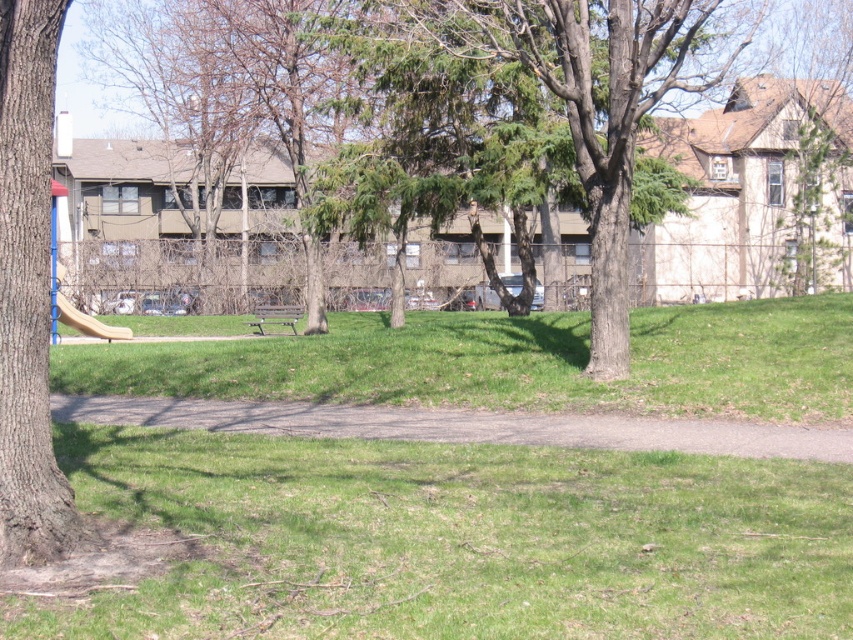
You are a parent trying to locate your child who is playing near the light brown plastic slide at lower left. From your position near the brown rough bark tree at left, which direction should you walk to reach the slide?

You should walk to the left because the light brown plastic slide at lower left is to the left of the brown rough bark tree at left.

You are a parent trying to decide where to place a new small garden ornament. The ornament is 1 foot wide. You have two options near the brown rough bark tree at left and the light brown plastic slide at lower left. Which location has enough space for the ornament?

The light brown plastic slide at lower left has a greater width than the brown rough bark tree at left, so placing the ornament near the light brown plastic slide at lower left would provide sufficient space since it is wider.

In the scene shown: You are a park visitor trying to decide whether to sit under the brown rough bark tree at left or the light brown plastic slide at left. Which one has a wider base to provide more shade?

The light brown plastic slide at left has a wider base than the brown rough bark tree at left, so it provides more shade.